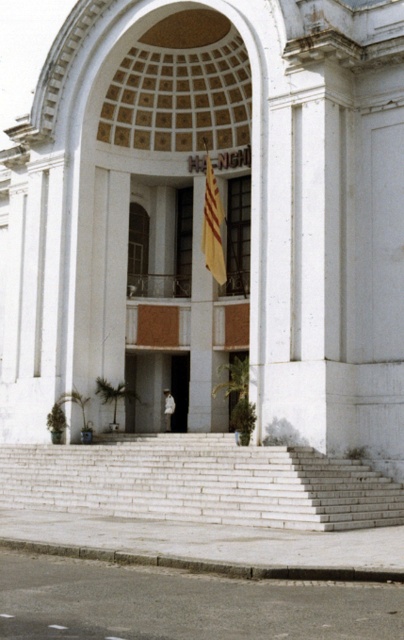
Who is positioned more to the right, white stone stairs at center or yellow fabric flag at center?

Positioned to the right is yellow fabric flag at center.

Who is lower down, white stone stairs at center or yellow fabric flag at center?

white stone stairs at center is lower down.

What do you see at coordinates (199, 483) in the screenshot? The height and width of the screenshot is (640, 404). I see `white stone stairs at center` at bounding box center [199, 483].

Where is `white stone stairs at center`? The image size is (404, 640). white stone stairs at center is located at coordinates (199, 483).

Is white stone archway at center bigger than white matte skateboarder at center?

Yes.

Which of these two, white stone archway at center or white matte skateboarder at center, stands taller?

Standing taller between the two is white stone archway at center.

Does point (88, 132) come behind point (168, 408)?

No, it is not.

Find the location of a particular element. This screenshot has height=640, width=404. white stone archway at center is located at coordinates (161, 216).

Which is in front, point (227, 497) or point (172, 397)?

Point (227, 497)

Between white stone stairs at center and white matte skateboarder at center, which one is positioned higher?

white matte skateboarder at center is higher up.

Between point (138, 477) and point (172, 406), which one is positioned behind?

Positioned behind is point (172, 406).

This screenshot has width=404, height=640. What are the coordinates of `white stone stairs at center` in the screenshot? It's located at (199, 483).